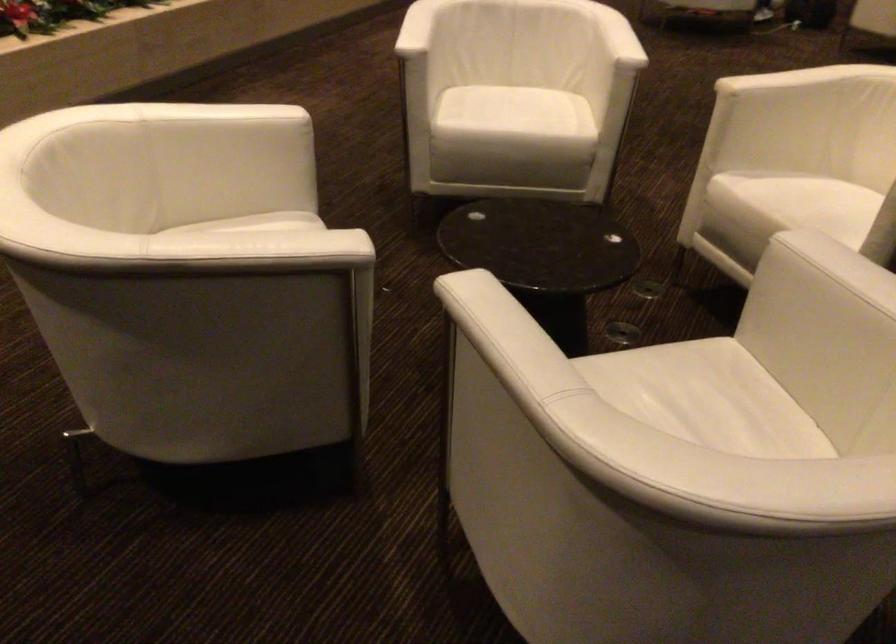
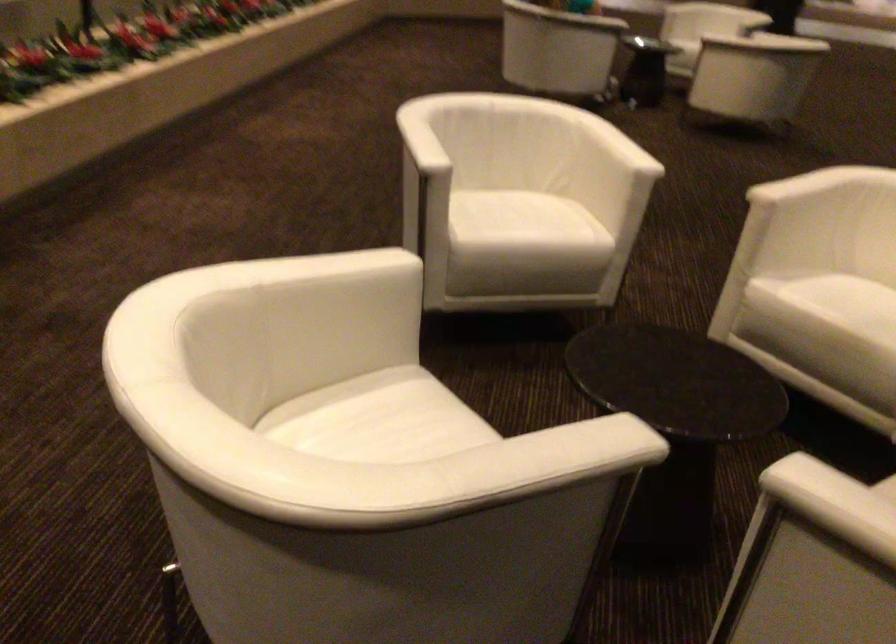
Which direction would the cameraman need to move to produce the second image?

The movement direction of the cameraman is left, forward.